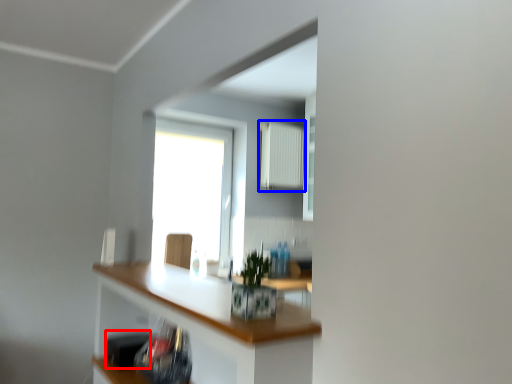
Question: Which of the following is the closest to the observer, appliance (highlighted by a red box) or radiator (highlighted by a blue box)?

Choices:
 (A) appliance
 (B) radiator

Answer: (A)